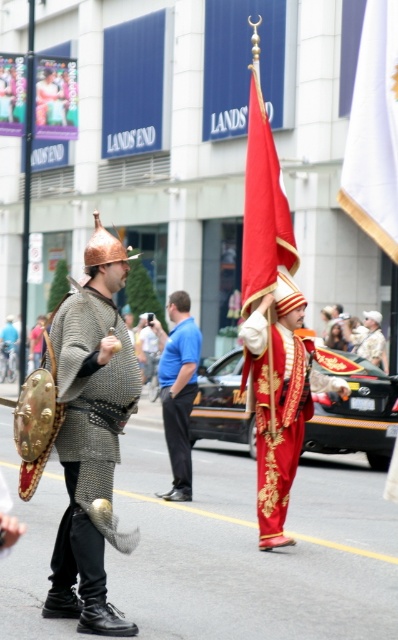
Between chainmail armor at center and silky red flag at center, which one appears on the left side from the viewer's perspective?

Positioned to the left is chainmail armor at center.

The height and width of the screenshot is (640, 398). In order to click on chainmail armor at center in this screenshot , I will do `click(91, 435)`.

The height and width of the screenshot is (640, 398). Identify the location of chainmail armor at center. (91, 435).

Does point (394, 99) come closer to viewer compared to point (189, 381)?

That is True.

Who is taller, white fabric flag at upper right or blue cotton shirt at center?

blue cotton shirt at center is taller.

Does point (360, 163) come farther from viewer compared to point (173, 308)?

No.

Identify the location of white fabric flag at upper right. This screenshot has width=398, height=640. (374, 131).

What do you see at coordinates (91, 435) in the screenshot? I see `chainmail armor at center` at bounding box center [91, 435].

From the picture: Between chainmail armor at center and white fabric flag at upper right, which one is positioned higher?

white fabric flag at upper right

Locate an element on the screen. The image size is (398, 640). chainmail armor at center is located at coordinates (91, 435).

Identify the location of chainmail armor at center. (91, 435).